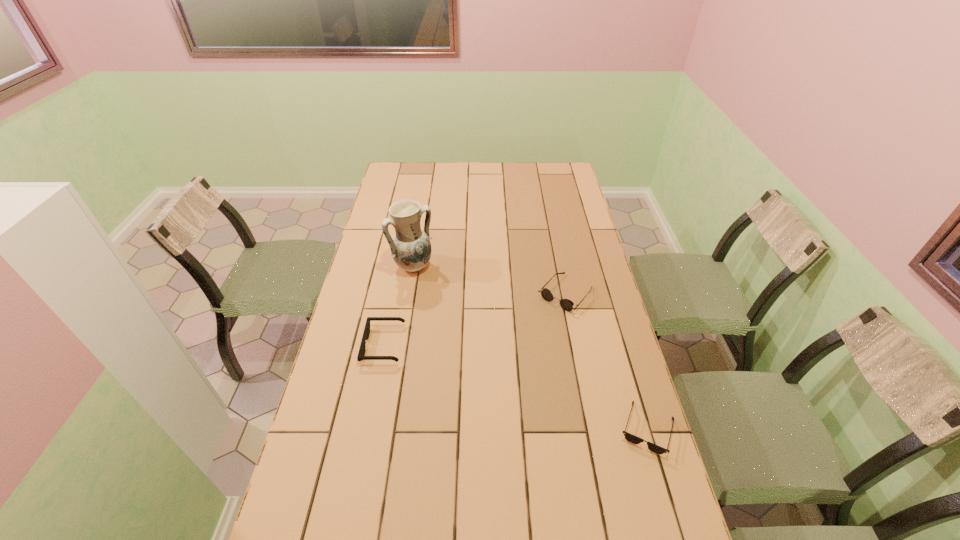
The height and width of the screenshot is (540, 960). In order to click on vacant space on the desktop that is between the second nearest object and the nearest object and is positioned on the front-facing side of the third shortest object in this screenshot , I will do `click(490, 379)`.

The image size is (960, 540). Find the location of `vacant space on the desktop that is between the second farthest sunglasses and the nearest sunglasses and is positioned on either side of the pottery`. vacant space on the desktop that is between the second farthest sunglasses and the nearest sunglasses and is positioned on either side of the pottery is located at coordinates (538, 394).